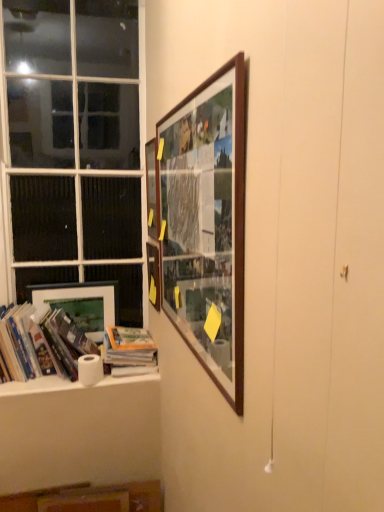
Question: Is hardcover books at left, the 2th book in the right-to-left sequence, aimed at wooden picture frame at upper center, placed as the 1th picture frame when sorted from right to left?

Choices:
 (A) yes
 (B) no

Answer: (B)

Question: Is hardcover books at left, placed as the first book when sorted from left to right, bigger than wooden picture frame at upper center, placed as the 1th picture frame when sorted from right to left?

Choices:
 (A) yes
 (B) no

Answer: (A)

Question: Is hardcover books at left, the 2th book in the right-to-left sequence, looking in the opposite direction of wooden picture frame at upper center, which is counted as the fourth picture frame, starting from the left?

Choices:
 (A) no
 (B) yes

Answer: (A)

Question: Is hardcover books at left, placed as the first book when sorted from left to right, closer to the viewer compared to wooden picture frame at upper center, marked as the 1th picture frame in a front-to-back arrangement?

Choices:
 (A) yes
 (B) no

Answer: (B)

Question: Is hardcover books at left, placed as the first book when sorted from left to right, wider than wooden picture frame at upper center, placed as the 1th picture frame when sorted from right to left?

Choices:
 (A) yes
 (B) no

Answer: (A)

Question: Does point (150, 270) appear closer or farther from the camera than point (177, 197)?

Choices:
 (A) closer
 (B) farther

Answer: (B)

Question: Would you say wooden picture frame at upper center, which appears as the third picture frame when viewed from the front, is inside or outside wooden picture frame at upper center, which is the 4th picture frame in back-to-front order?

Choices:
 (A) outside
 (B) inside

Answer: (A)

Question: From the image's perspective, is wooden picture frame at upper center, acting as the second picture frame starting from the left, above or below wooden picture frame at upper center, marked as the 1th picture frame in a front-to-back arrangement?

Choices:
 (A) above
 (B) below

Answer: (B)

Question: Is wooden picture frame at upper center, the third picture frame when ordered from right to left, to the left or to the right of wooden picture frame at upper center, which is counted as the fourth picture frame, starting from the left, in the image?

Choices:
 (A) right
 (B) left

Answer: (B)

Question: From a real-world perspective, is hardcover books at left, the 2th book in the right-to-left sequence, above or below wooden picture frame at upper center, which is counted as the fourth picture frame, starting from the left?

Choices:
 (A) above
 (B) below

Answer: (B)

Question: Based on their positions, is hardcover books at left, placed as the first book when sorted from left to right, located to the left or right of wooden picture frame at upper center, placed as the 1th picture frame when sorted from right to left?

Choices:
 (A) left
 (B) right

Answer: (A)

Question: Choose the correct answer: Is hardcover books at left, the 2th book in the right-to-left sequence, inside wooden picture frame at upper center, placed as the 1th picture frame when sorted from right to left, or outside it?

Choices:
 (A) outside
 (B) inside

Answer: (A)

Question: Looking at their shapes, would you say hardcover books at left, the 2th book in the right-to-left sequence, is wider or thinner than wooden picture frame at upper center, which is counted as the fourth picture frame, starting from the left?

Choices:
 (A) thin
 (B) wide

Answer: (B)

Question: From their relative heights in the image, would you say hardcover book at lower left, which ranks as the second book in left-to-right order, is taller or shorter than hardcover books at left, the 2th book in the right-to-left sequence?

Choices:
 (A) tall
 (B) short

Answer: (B)

Question: In the image, is hardcover book at lower left, the 1th book positioned from the right, positioned in front of or behind hardcover books at left, the 2th book in the right-to-left sequence?

Choices:
 (A) front
 (B) behind

Answer: (B)